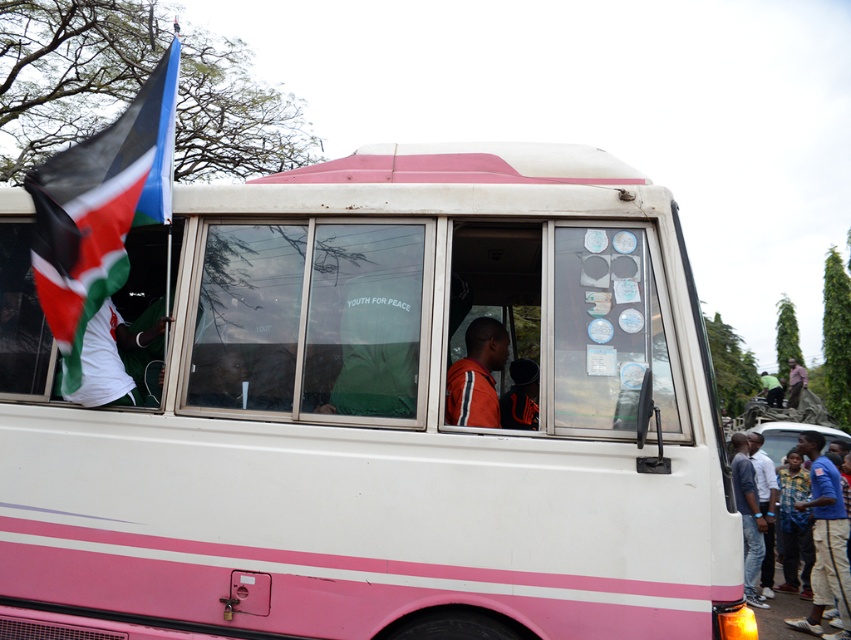
Consider the image. You are a tailor measuring the distance between two pairs of jeans in the image. The jeans at right and the blue jeans at lower right. Can you fit a 10 inch ruler between them?

The distance between the jeans at right and the blue jeans at lower right is 11.24 inches, so yes, a 10 inch ruler can fit between them since it is shorter than the distance between the two jeans.

You are a photographer standing in front of the white bus with pink stripes. You need to capture a photo of the orange jersey at center without including the flag held by the person outside. Where should you position yourself relative to the bus?

To avoid including the flag held by the person outside, position yourself to the left side of the bus since the orange jersey at center is located at point (477, 376), which is towards the center of the bus. The flag is on the outside, so positioning to the left would keep it out of frame.

You are a photographer wanting to capture both the white matte tour bus at center and the dark brown leather jacket at center in a single frame. Since you can only adjust the camera angle, which object should you focus on first to ensure both fit in the frame?

Since the white matte tour bus at center is taller than the dark brown leather jacket at center, you should focus on the white matte tour bus at center first to ensure its full height fits in the frame, allowing the smaller dark brown leather jacket at center to also be included.